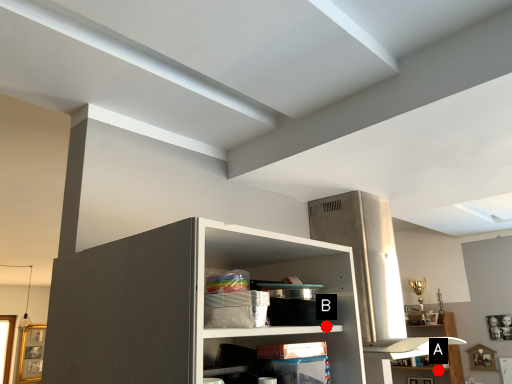
Question: Two points are circled on the image, labeled by A and B beside each circle. Which point is further to the camera?

Choices:
 (A) A is further
 (B) B is further

Answer: (A)